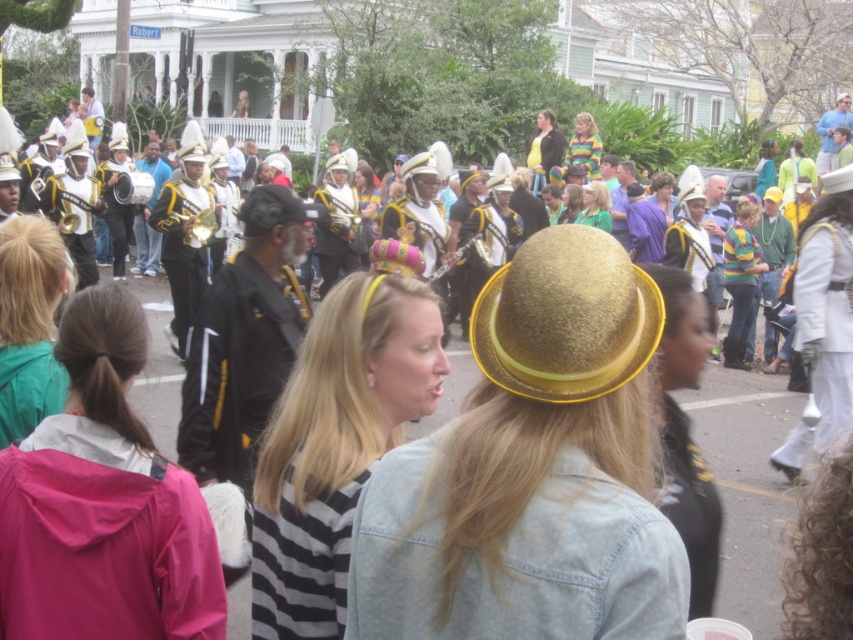
Who is positioned more to the right, faded denim jacket at lower right or striped fabric headband at center?

From the viewer's perspective, faded denim jacket at lower right appears more on the right side.

Image resolution: width=853 pixels, height=640 pixels. In order to click on faded denim jacket at lower right in this screenshot , I will do `click(532, 472)`.

Does pink fabric jacket at lower left appear on the right side of matte gold crown at center?

Incorrect, pink fabric jacket at lower left is not on the right side of matte gold crown at center.

Find the location of a particular element. Image resolution: width=853 pixels, height=640 pixels. pink fabric jacket at lower left is located at coordinates (103, 502).

Between gold textured hat at center and matte gold crown at center, which one has more height?

With more height is gold textured hat at center.

Does point (503, 376) come behind point (585, 216)?

No, (503, 376) is in front of (585, 216).

Is point (636, 349) in front of point (592, 216)?

Yes, point (636, 349) is closer to viewer.

Find the location of a particular element. gold textured hat at center is located at coordinates (566, 317).